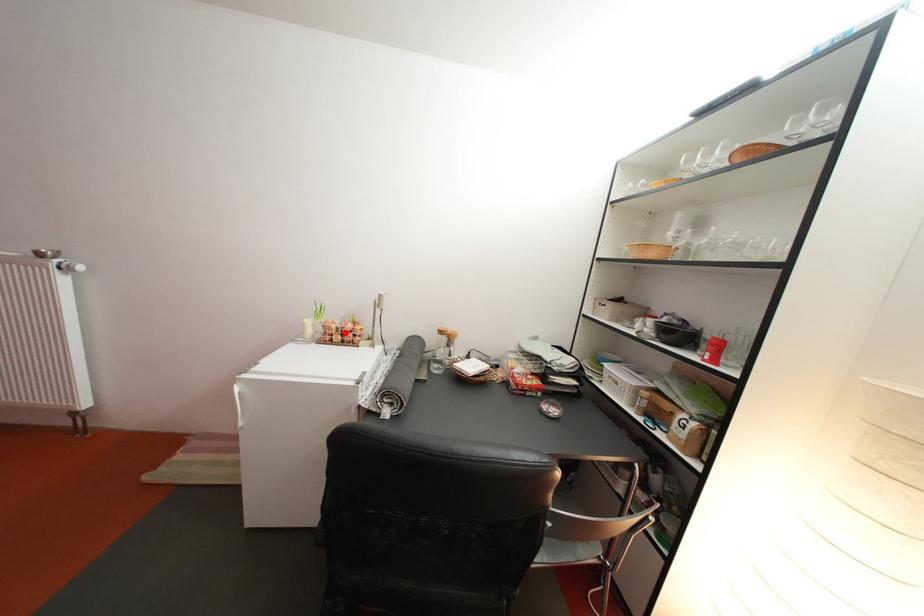
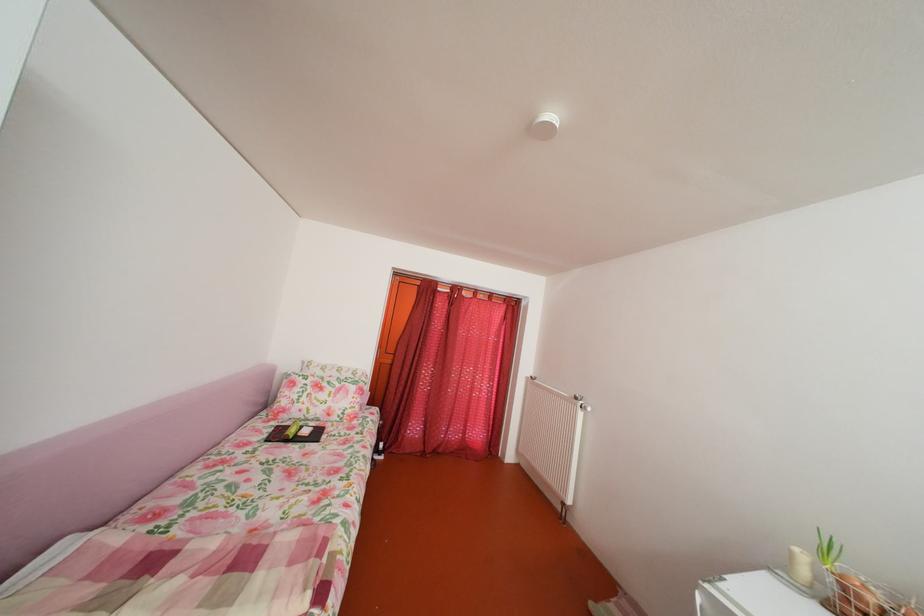
Question: I am providing you with two images of the same scene from different viewpoints. Image1 has a red point marked. In image2, the corresponding 3D location appears at what relative position? Reply with the corresponding letter.

Choices:
 (A) Closer
 (B) Farther

Answer: (A)